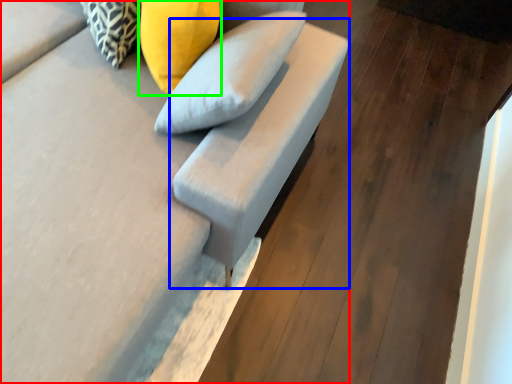
Question: Considering the real-world distances, which object is closest to furniture (highlighted by a red box)? armchair (highlighted by a blue box) or pillow (highlighted by a green box).

Choices:
 (A) armchair
 (B) pillow

Answer: (A)